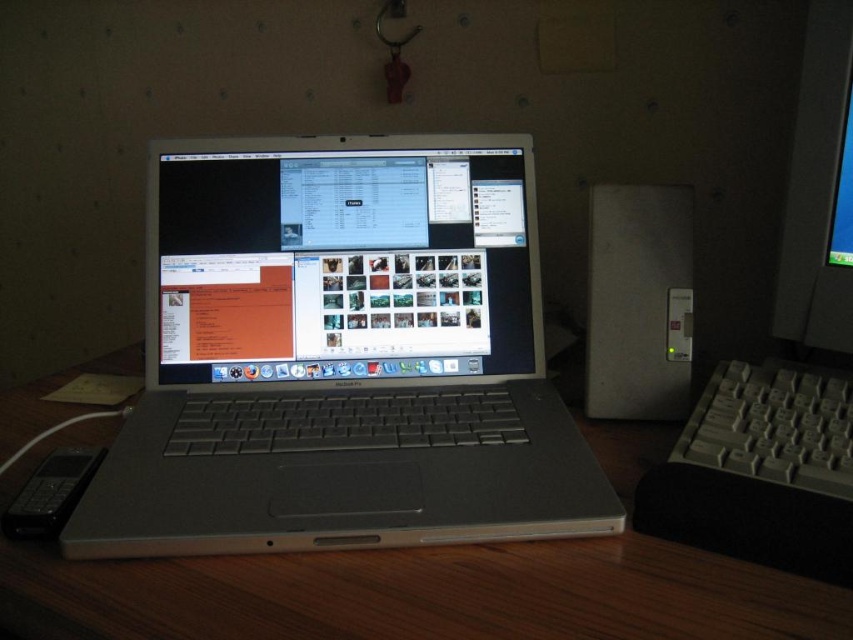
Can you confirm if silver metallic laptop at center is bigger than matte black monitor at right?

Correct, silver metallic laptop at center is larger in size than matte black monitor at right.

I want to click on silver metallic laptop at center, so click(341, 356).

Locate an element on the screen. silver metallic laptop at center is located at coordinates (341, 356).

Between silver metallic laptop at center and satin silver desktop computer at right, which one has less height?

satin silver desktop computer at right is shorter.

Can you confirm if silver metallic laptop at center is positioned above satin silver desktop computer at right?

No.

Which is in front, point (419, 355) or point (668, 280)?

Positioned in front is point (668, 280).

Locate an element on the screen. This screenshot has width=853, height=640. silver metallic laptop at center is located at coordinates (341, 356).

Can you confirm if wooden desk at center is positioned to the left of satin silver desktop computer at right?

Yes, wooden desk at center is to the left of satin silver desktop computer at right.

Which is behind, point (471, 612) or point (613, 289)?

The point (613, 289) is more distant.

The width and height of the screenshot is (853, 640). What are the coordinates of `wooden desk at center` in the screenshot? It's located at (432, 586).